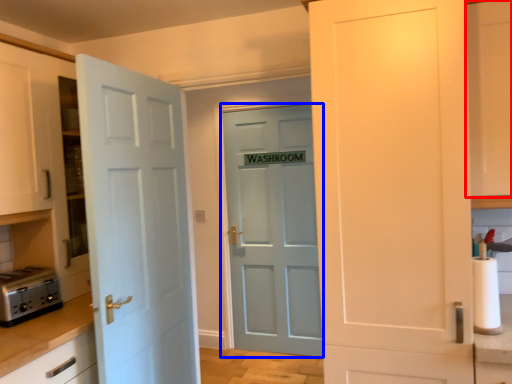
Question: Which object is further to the camera taking this photo, cabinetry (highlighted by a red box) or door (highlighted by a blue box)?

Choices:
 (A) cabinetry
 (B) door

Answer: (B)